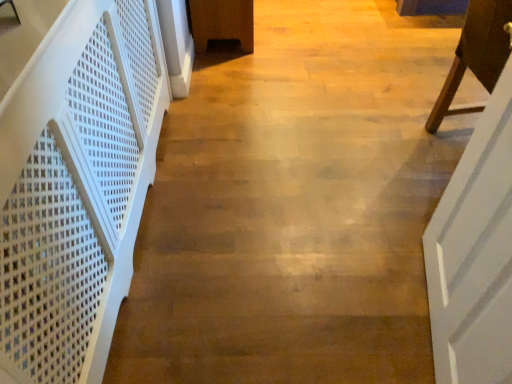
Image resolution: width=512 pixels, height=384 pixels. In order to click on free region under brown wooden chair at right (from a real-world perspective) in this screenshot , I will do pyautogui.click(x=442, y=144).